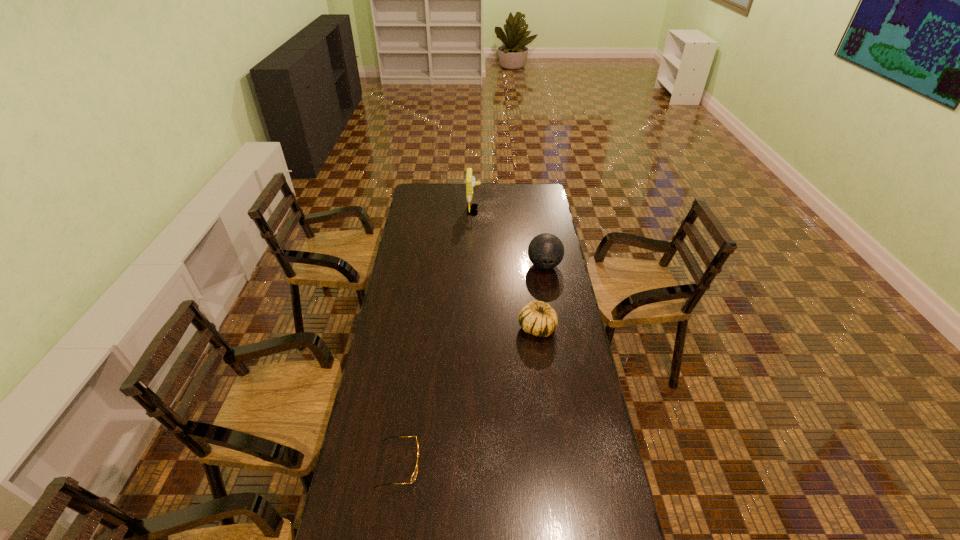
Where is `the second object from left to right`? the second object from left to right is located at coordinates (470, 180).

Find the location of a particular element. Image resolution: width=960 pixels, height=540 pixels. the farthest object is located at coordinates (470, 180).

Where is `the third shortest object`? Image resolution: width=960 pixels, height=540 pixels. the third shortest object is located at coordinates (545, 251).

Find the location of `the second farthest object`. the second farthest object is located at coordinates 545,251.

Where is `gourd`? This screenshot has height=540, width=960. gourd is located at coordinates (537, 318).

What are the coordinates of `the third tallest object` in the screenshot? It's located at (537, 318).

Locate an element on the screen. This screenshot has width=960, height=540. the leftmost object is located at coordinates (414, 474).

What are the coordinates of `the shortest object` in the screenshot? It's located at pyautogui.click(x=414, y=474).

Locate an element on the screen. The width and height of the screenshot is (960, 540). vacant space located 0.390m on the face of the tallest object is located at coordinates (549, 210).

The height and width of the screenshot is (540, 960). I want to click on vacant area located 0.310m on the grip area of the bowling ball, so click(x=555, y=326).